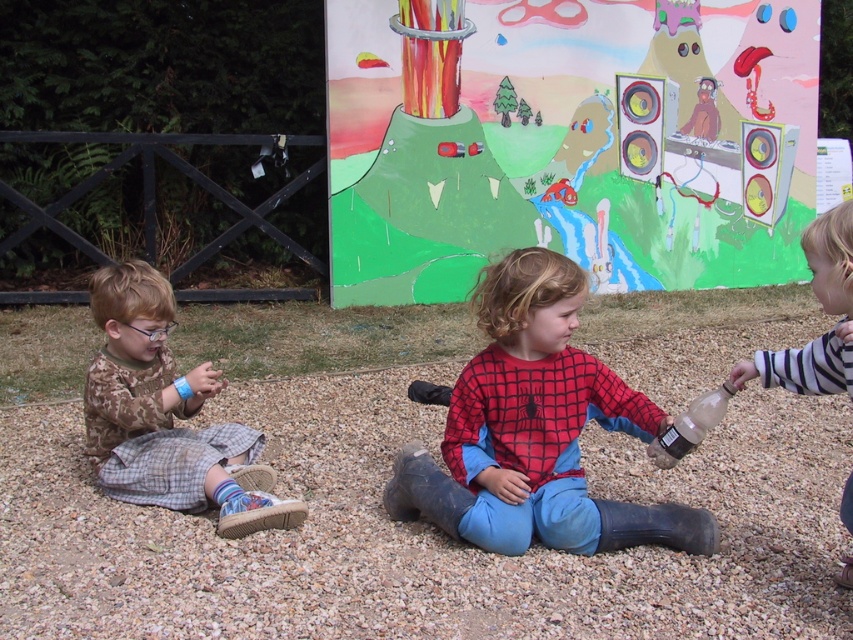
Question: Estimate the real-world distances between objects in this image. Which object is closer to the striped cotton shirt at right?

Choices:
 (A) gray gravel at center
 (B) red plaid shirt at center
 (C) clear plastic bottle at center

Answer: (C)

Question: Among these objects, which one is farthest from the camera?

Choices:
 (A) camouflage fabric shirt at left
 (B) striped cotton shirt at right
 (C) clear plastic bottle at center
 (D) red plaid shirt at center

Answer: (A)

Question: Is gray gravel at center smaller than red plaid shirt at center?

Choices:
 (A) yes
 (B) no

Answer: (B)

Question: Which object is the farthest from the red plaid shirt at center?

Choices:
 (A) camouflage fabric shirt at left
 (B) clear plastic bottle at center
 (C) gray gravel at center

Answer: (A)

Question: Can you confirm if gray gravel at center is bigger than striped cotton shirt at right?

Choices:
 (A) no
 (B) yes

Answer: (B)

Question: Is red plaid shirt at center above clear plastic bottle at center?

Choices:
 (A) yes
 (B) no

Answer: (B)